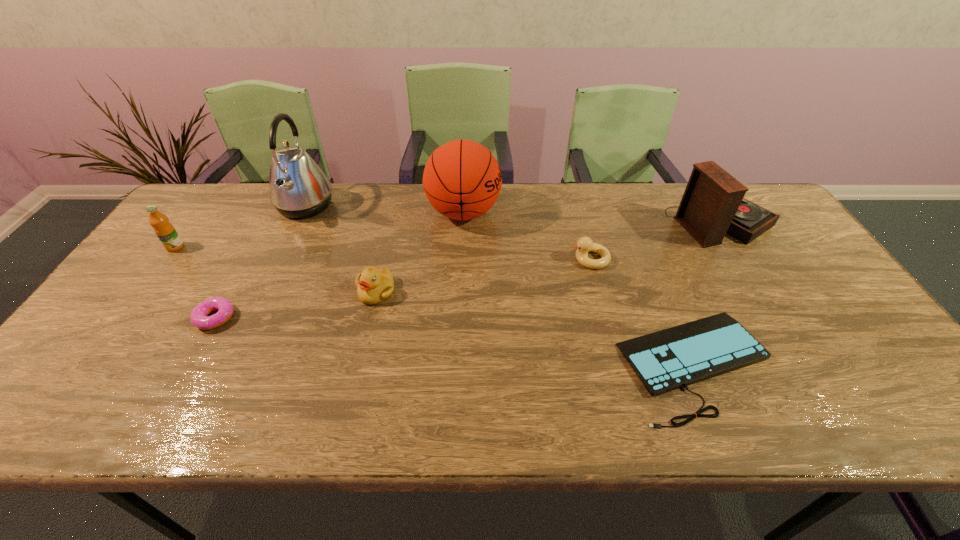
At what (x,y) coordinates should I click in order to perform the action: click on vacant space located on the left of the computer keyboard. Please return your answer as a coordinate pair (x, y). Image resolution: width=960 pixels, height=540 pixels. Looking at the image, I should click on (530, 364).

The width and height of the screenshot is (960, 540). I want to click on kettle that is at the far edge, so (298, 188).

Where is `basketball present at the far edge`? The height and width of the screenshot is (540, 960). basketball present at the far edge is located at coordinates (462, 180).

Image resolution: width=960 pixels, height=540 pixels. Identify the location of phonograph record present at the far edge. (712, 204).

Locate an element on the screen. object at the near edge is located at coordinates (665, 360).

Locate an element on the screen. This screenshot has width=960, height=540. object that is positioned at the left edge is located at coordinates click(165, 231).

Image resolution: width=960 pixels, height=540 pixels. I want to click on object present at the right edge, so click(712, 204).

Find the location of a particular element. The width and height of the screenshot is (960, 540). object at the far right corner is located at coordinates (712, 204).

In the image, there is a desktop. Where is `vacant space at the far edge`? This screenshot has height=540, width=960. vacant space at the far edge is located at coordinates 565,207.

Where is `vacant space at the near edge`? The height and width of the screenshot is (540, 960). vacant space at the near edge is located at coordinates (x=480, y=412).